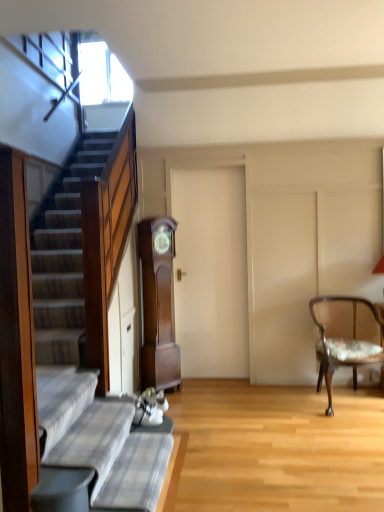
Question: Is wooden cane chair with floral cushion at right looking in the opposite direction of plaid fabric couch at lower left?

Choices:
 (A) yes
 (B) no

Answer: (B)

Question: Considering the relative sizes of wooden cane chair with floral cushion at right and plaid fabric couch at lower left in the image provided, is wooden cane chair with floral cushion at right taller than plaid fabric couch at lower left?

Choices:
 (A) no
 (B) yes

Answer: (B)

Question: Is wooden cane chair with floral cushion at right shorter than plaid fabric couch at lower left?

Choices:
 (A) yes
 (B) no

Answer: (B)

Question: Is wooden cane chair with floral cushion at right outside plaid fabric couch at lower left?

Choices:
 (A) yes
 (B) no

Answer: (A)

Question: Considering the relative sizes of wooden cane chair with floral cushion at right and plaid fabric couch at lower left in the image provided, is wooden cane chair with floral cushion at right wider than plaid fabric couch at lower left?

Choices:
 (A) yes
 (B) no

Answer: (A)

Question: Is brown wood grandfather clock at center bigger or smaller than wooden cane chair with floral cushion at right?

Choices:
 (A) big
 (B) small

Answer: (B)

Question: In the image, is brown wood grandfather clock at center positioned in front of or behind wooden cane chair with floral cushion at right?

Choices:
 (A) front
 (B) behind

Answer: (B)

Question: Is brown wood grandfather clock at center inside the boundaries of wooden cane chair with floral cushion at right, or outside?

Choices:
 (A) inside
 (B) outside

Answer: (B)

Question: Is brown wood grandfather clock at center wider or thinner than wooden cane chair with floral cushion at right?

Choices:
 (A) wide
 (B) thin

Answer: (B)

Question: Visually, is plaid fabric couch at lower left positioned to the left or to the right of brown wood grandfather clock at center?

Choices:
 (A) left
 (B) right

Answer: (A)

Question: Considering the positions of plaid fabric couch at lower left and brown wood grandfather clock at center in the image, is plaid fabric couch at lower left wider or thinner than brown wood grandfather clock at center?

Choices:
 (A) thin
 (B) wide

Answer: (B)

Question: From their relative heights in the image, would you say plaid fabric couch at lower left is taller or shorter than brown wood grandfather clock at center?

Choices:
 (A) short
 (B) tall

Answer: (A)

Question: From the image's perspective, is plaid fabric couch at lower left above or below brown wood grandfather clock at center?

Choices:
 (A) below
 (B) above

Answer: (A)

Question: In the image, is brown wood grandfather clock at center positioned in front of or behind plaid fabric couch at lower left?

Choices:
 (A) front
 (B) behind

Answer: (B)

Question: Is brown wood grandfather clock at center wider or thinner than plaid fabric couch at lower left?

Choices:
 (A) thin
 (B) wide

Answer: (A)